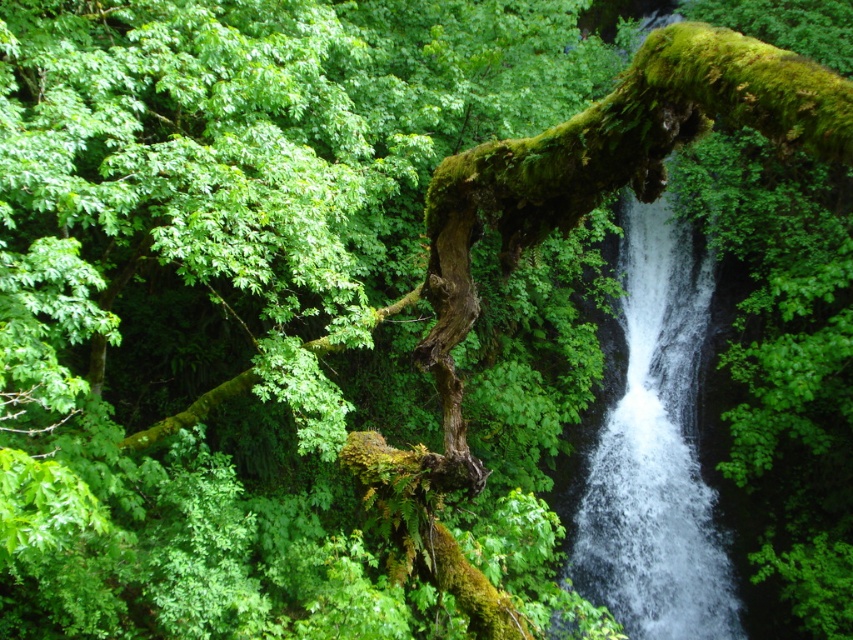
Question: Is green mossy branch at center to the right of white frothy water at center from the viewer's perspective?

Choices:
 (A) no
 (B) yes

Answer: (A)

Question: Which point is farther from the camera taking this photo?

Choices:
 (A) (474, 224)
 (B) (631, 342)

Answer: (B)

Question: Is green mossy branch at center bigger than white frothy water at center?

Choices:
 (A) yes
 (B) no

Answer: (B)

Question: Which object appears farthest from the camera in this image?

Choices:
 (A) white frothy water at center
 (B) green mossy branch at center

Answer: (A)

Question: Which point appears closest to the camera in this image?

Choices:
 (A) (434, 470)
 (B) (700, 333)

Answer: (A)

Question: Is green mossy branch at center wider than white frothy water at center?

Choices:
 (A) no
 (B) yes

Answer: (A)